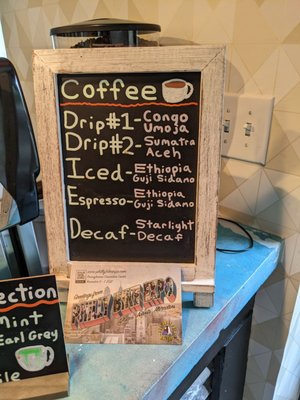
Identify the location of ivory tile. (253, 192).